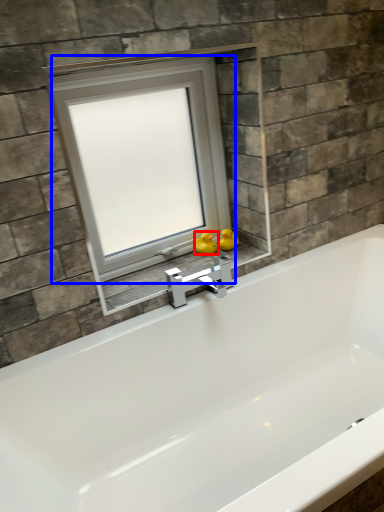
Question: Which point is closer to the camera, duck (highlighted by a red box) or window (highlighted by a blue box)?

Choices:
 (A) duck
 (B) window

Answer: (B)